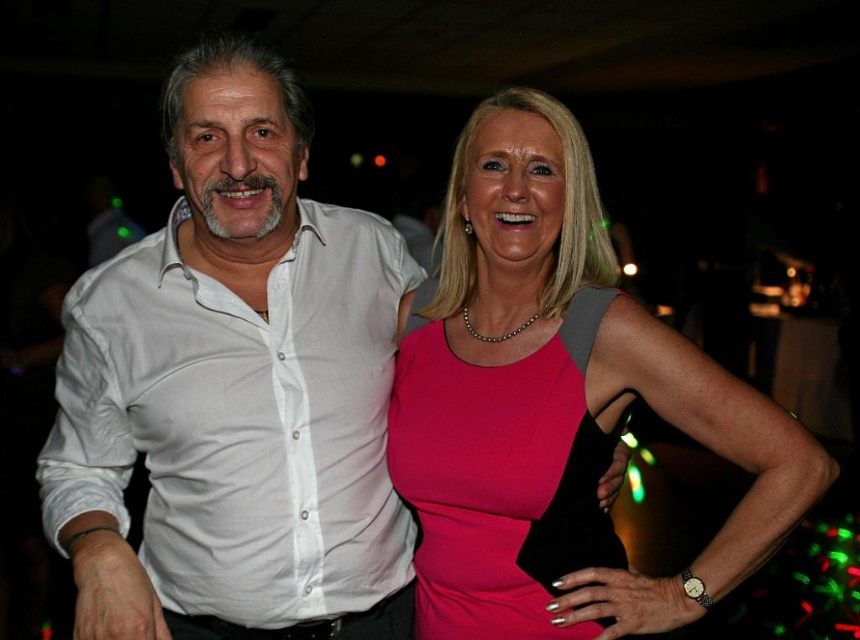
Question: Is pink matte dress at center closer to camera compared to pink satin dress at center?

Choices:
 (A) yes
 (B) no

Answer: (A)

Question: Among these points, which one is nearest to the camera?

Choices:
 (A) (418, 378)
 (B) (576, 500)

Answer: (B)

Question: In this image, where is pink matte dress at center located relative to pink satin dress at center?

Choices:
 (A) below
 (B) above

Answer: (B)

Question: Which of the following is the closest to the observer?

Choices:
 (A) pink satin dress at center
 (B) white cotton shirt at left
 (C) pink matte dress at center

Answer: (B)

Question: Does pink matte dress at center have a larger size compared to pink satin dress at center?

Choices:
 (A) yes
 (B) no

Answer: (A)

Question: Among these objects, which one is farthest from the camera?

Choices:
 (A) white cotton shirt at left
 (B) pink matte dress at center
 (C) pink satin dress at center

Answer: (C)